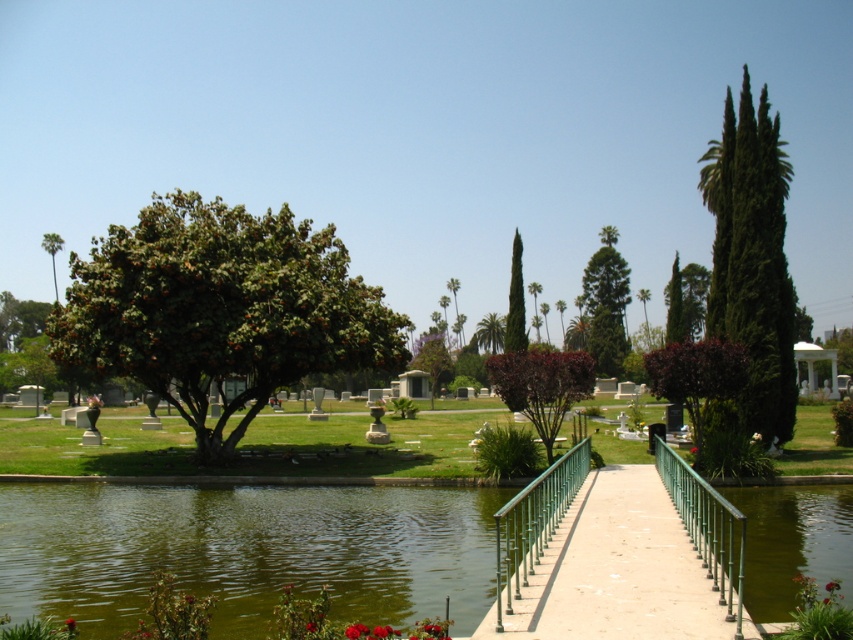
You are standing at the entrance of the park and want to take a photo of the green textured tree at center. Which direction should you face to ensure the tree is in the frame?

The green textured tree at center is located at point (606, 305), which is centrally positioned in the scene. Facing towards the center of the park area should keep the tree within your view for the photo.

You are standing at the center of the park scene and see the green metal railing at center and the red matte flower at center. Which object is positioned to the left?

The red matte flower at center is positioned to the left of the green metal railing at center.